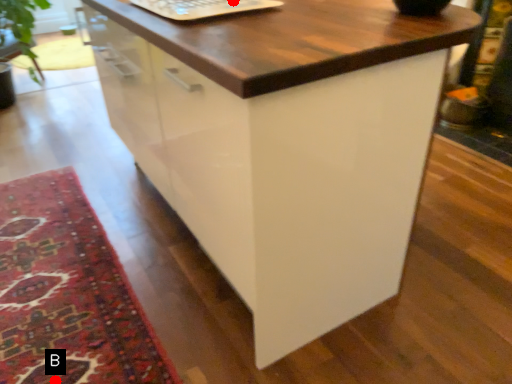
Question: Two points are circled on the image, labeled by A and B beside each circle. Which point appears farthest from the camera in this image?

Choices:
 (A) A is further
 (B) B is further

Answer: (A)